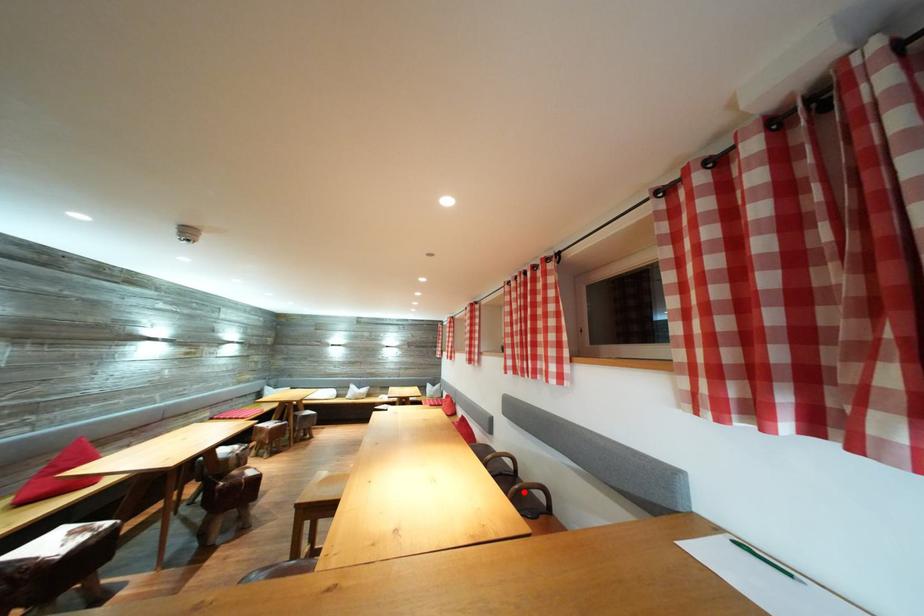
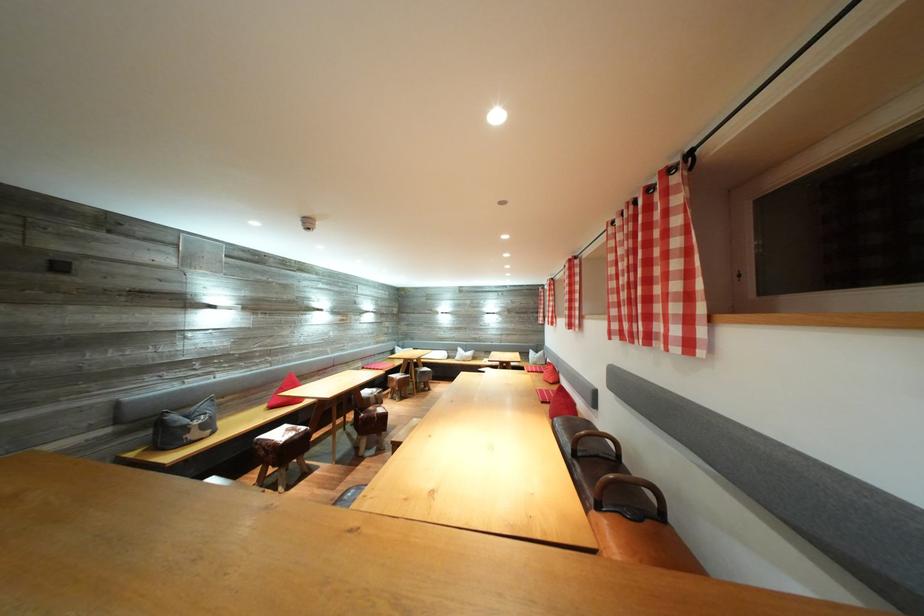
Where in the second image is the point corresponding to the highlighted location from the first image?

(618, 482)